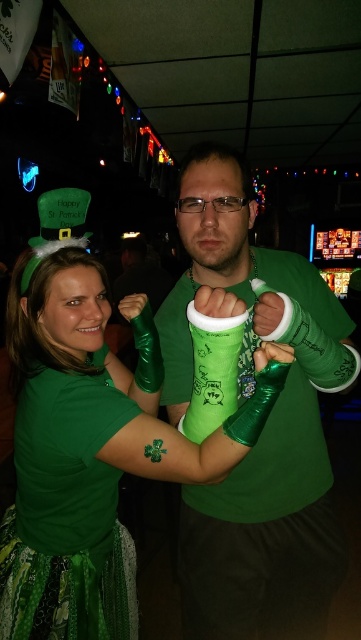
You are organizing a St. Patrick Day costume party and need to decide whether the matte green shirt at center can be worn over the shiny green arm bands at center. Based on their sizes, will the shirt accommodate the arm bands comfortably?

The matte green shirt at center is larger in size than the shiny green arm bands at center, so the shirt can comfortably accommodate the arm bands.